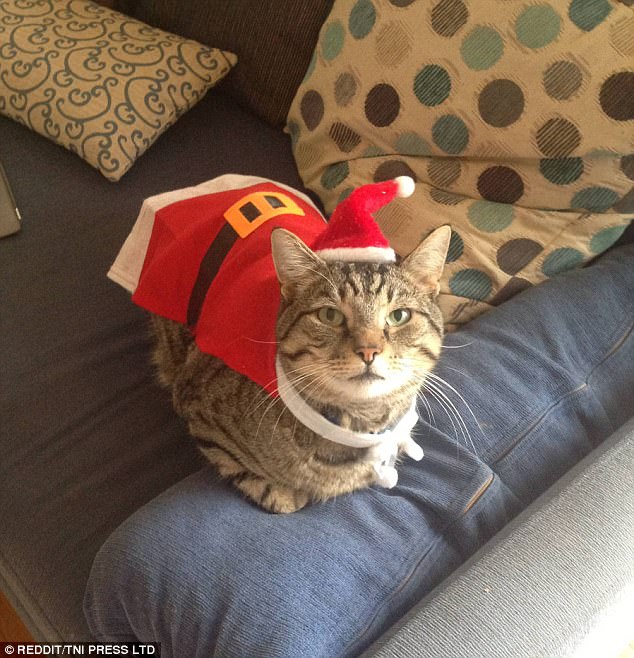
What are the coordinates of `gray couch` in the screenshot? It's located at (555, 566).